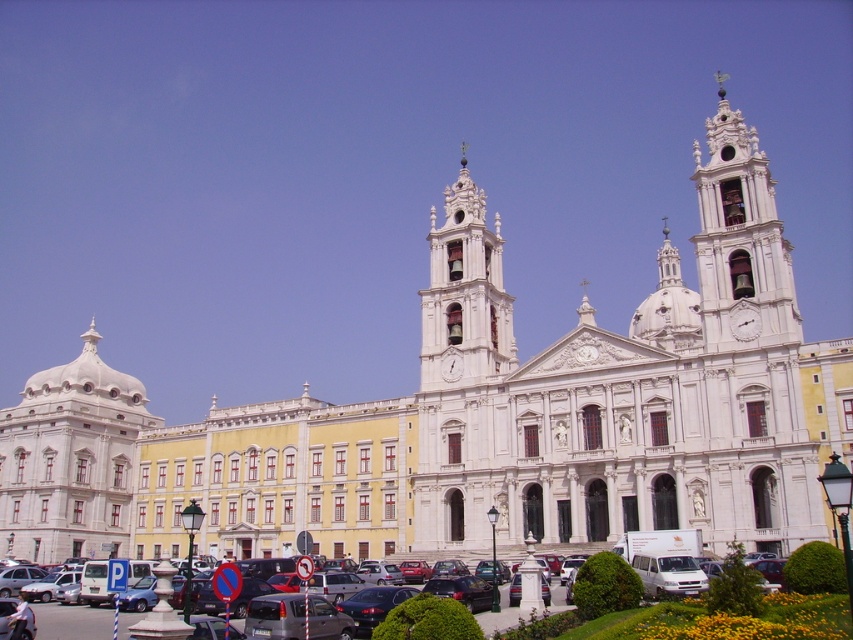
Question: Which point appears closest to the camera in this image?

Choices:
 (A) (463, 182)
 (B) (108, 467)
 (C) (122, 634)

Answer: (C)

Question: Observing the image, what is the correct spatial positioning of white ornate clock tower at center in reference to matte black car at center?

Choices:
 (A) above
 (B) below

Answer: (A)

Question: Where is white marble dome at left located in relation to matte black car at center in the image?

Choices:
 (A) right
 (B) left

Answer: (B)

Question: Which object is farther from the camera taking this photo?

Choices:
 (A) matte black car at center
 (B) white marble dome at left

Answer: (B)

Question: Which point is closer to the camera taking this photo?

Choices:
 (A) (91, 388)
 (B) (473, 188)

Answer: (B)

Question: In this image, where is white marble dome at left located relative to white ornate clock tower at center?

Choices:
 (A) right
 (B) left

Answer: (B)